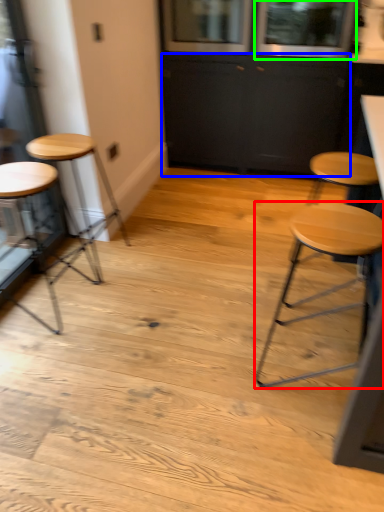
Question: Based on their relative distances, which object is nearer to stool (highlighted by a red box)? Choose from cabinetry (highlighted by a blue box) and window (highlighted by a green box).

Choices:
 (A) cabinetry
 (B) window

Answer: (A)